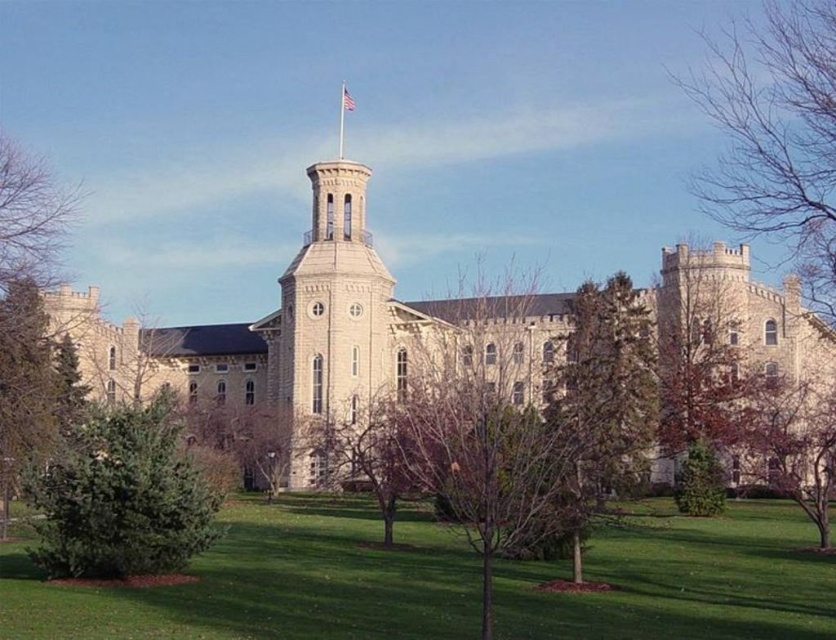
Which is behind, point (646, 372) or point (697, 493)?

Positioned behind is point (646, 372).

Is green leafy tree at center below green textured tree at lower right?

No, green leafy tree at center is not below green textured tree at lower right.

Which is behind, point (571, 516) or point (696, 461)?

Positioned behind is point (696, 461).

Image resolution: width=836 pixels, height=640 pixels. I want to click on green leafy tree at center, so click(x=604, y=396).

Which of these two, green leafy tree at center or brown textured tree at right, stands shorter?

brown textured tree at right

Does green leafy tree at center have a lesser height compared to brown textured tree at right?

Incorrect, green leafy tree at center's height does not fall short of brown textured tree at right's.

Looking at this image, measure the distance between point (640,435) and camera.

80.09 meters

Identify the location of green leafy tree at center. (604, 396).

The width and height of the screenshot is (836, 640). What do you see at coordinates (314, 326) in the screenshot?
I see `beige stone church at center` at bounding box center [314, 326].

Which of these two, beige stone church at center or bare branches at upper right, stands shorter?

Standing shorter between the two is beige stone church at center.

Between point (518, 374) and point (737, 45), which one is positioned in front?

Point (518, 374) is more forward.

Locate an element on the screen. This screenshot has height=640, width=836. beige stone church at center is located at coordinates (314, 326).